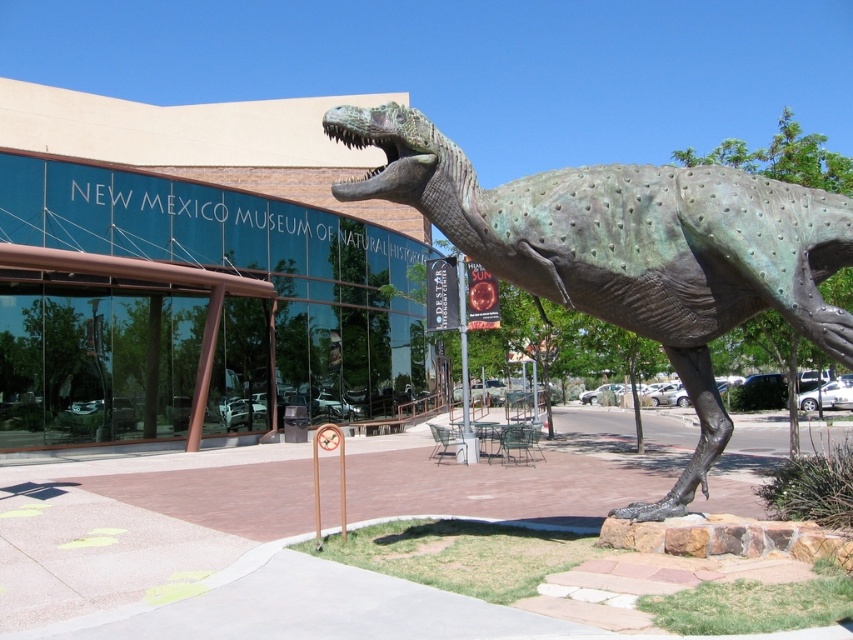
You are a tour guide leading a group to the entrance of the New Mexico Museum of Natural History. You see the green metallic dinosaur at right and the green polished stone dinosaur at center. Which one is closer to the museum entrance?

The green polished stone dinosaur at center is closer to the museum entrance because it is positioned at the center, while the green metallic dinosaur at right is further away at 17.64 meters from it.

You are planning to place a new bench in the museum courtyard. The bench needs to be placed between the green metallic dinosaur at right and the green polished stone dinosaur at center. Considering their sizes, which dinosaur should the bench be closer to for balance?

The bench should be placed closer to the green polished stone dinosaur at center because the green metallic dinosaur at right is larger in size, so balancing their sizes would require the bench to be nearer to the smaller one.

You are visiting the New Mexico Museum of Natural History and want to take a photo of both the green metallic dinosaur at right and the green polished stone dinosaur at center. Since you can only take one photo, which dinosaur should you position closer to the camera to include both in the frame?

You should position the green metallic dinosaur at right closer to the camera because the green polished stone dinosaur at center is behind it, allowing both to be in the frame when the metallic one is nearer.